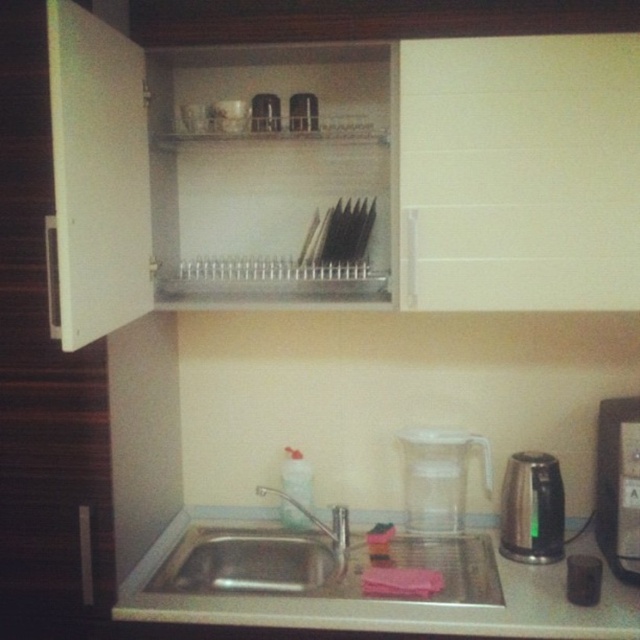
Question: Is stainless steel sink at lower center above stainless steel kettle at right?

Choices:
 (A) no
 (B) yes

Answer: (A)

Question: Which point is farther from the camera taking this photo?

Choices:
 (A) (522, 572)
 (B) (444, 516)

Answer: (B)

Question: Considering the real-world distances, which object is closest to the transparent plastic pitcher at lower center?

Choices:
 (A) stainless steel sink at lower center
 (B) black plastic coffee machine at right
 (C) stainless steel kettle at right

Answer: (C)

Question: Can you confirm if white glossy counter top at lower center is positioned to the left of stainless steel sink at lower center?

Choices:
 (A) yes
 (B) no

Answer: (B)

Question: Is stainless steel sink at lower center above stainless steel kettle at right?

Choices:
 (A) yes
 (B) no

Answer: (B)

Question: Which object is farther from the camera taking this photo?

Choices:
 (A) transparent plastic pitcher at lower center
 (B) white glossy counter top at lower center
 (C) black plastic coffee machine at right
 (D) stainless steel sink at lower center

Answer: (A)